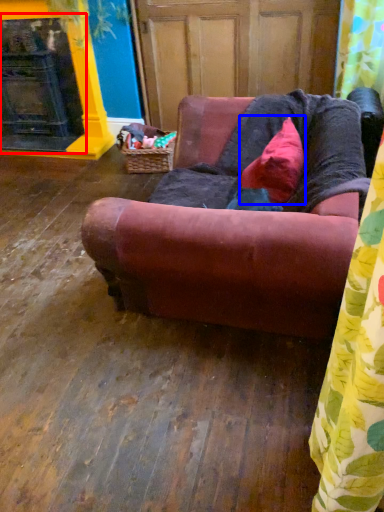
Question: Which object is further to the camera taking this photo, fireplace (highlighted by a red box) or pillow (highlighted by a blue box)?

Choices:
 (A) fireplace
 (B) pillow

Answer: (A)